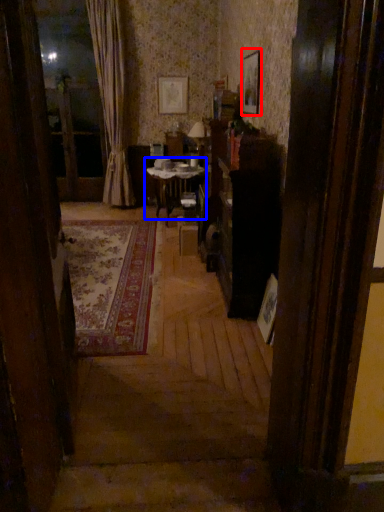
Question: Which object is further to the camera taking this photo, picture frame (highlighted by a red box) or table (highlighted by a blue box)?

Choices:
 (A) picture frame
 (B) table

Answer: (B)